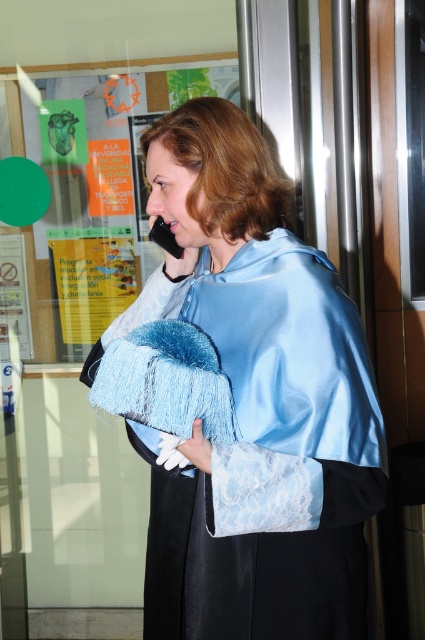
Does satin blue cape at center have a smaller size compared to green paper at upper left?

Actually, satin blue cape at center might be larger than green paper at upper left.

Which is above, satin blue cape at center or green paper at upper left?

green paper at upper left

Is point (237, 637) positioned after point (96, 253)?

No, (237, 637) is closer to viewer.

Identify the location of satin blue cape at center. (257, 396).